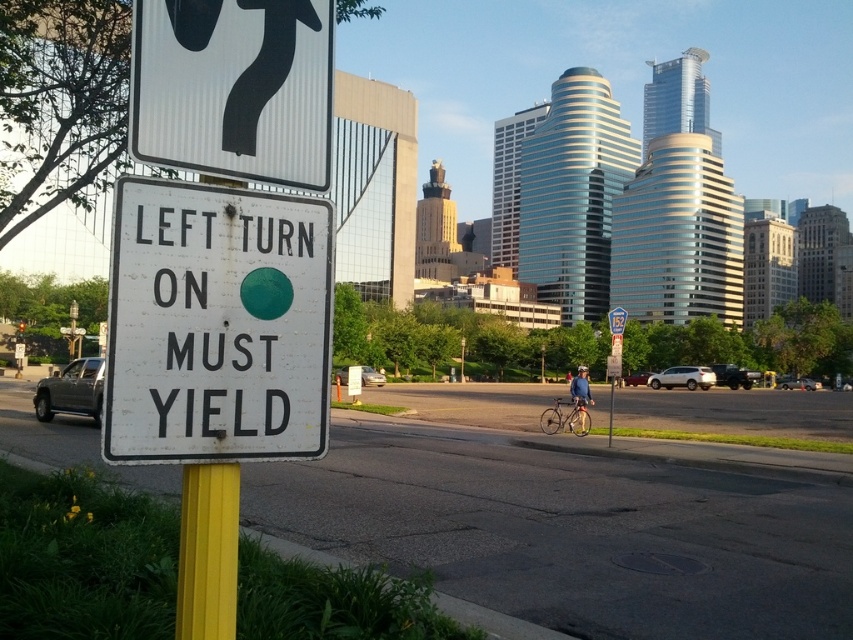
You are standing at the traffic sign and want to walk towards the city skyline. Which of the two points, point (186, 81) or point (548, 433), would you encounter first?

Point (186, 81) is in front of point (548, 433), so you would encounter point (186, 81) first when walking towards the city skyline.

You are a delivery driver approaching the intersection and see the white corrugated plastic sign at upper left and the silver metallic bicycle at center. Which object is nearer to you as you drive forward?

The white corrugated plastic sign at upper left is closer to the viewer than the silver metallic bicycle at center, so the white corrugated plastic sign at upper left is nearer to you as you drive forward.

You are a pedestrian standing in the middle of the street and see the white paper sign at center and the blue fabric jacket at center. Which object is closer to you?

The white paper sign at center is positioned over the blue fabric jacket at center, so it is closer to you.